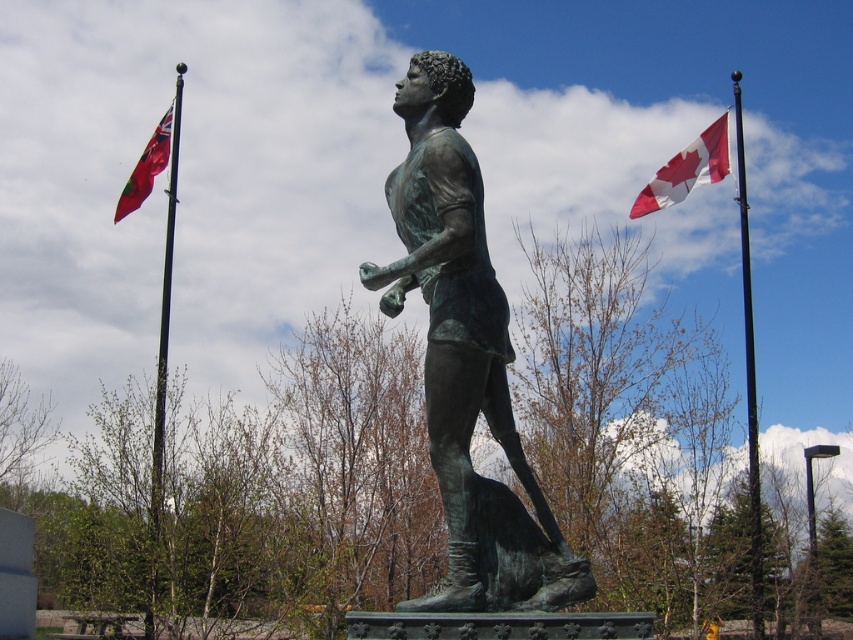
You are a visitor at a park with the bronze statue of a person standing upright facing left. You notice the polished metal flagpole at left and the red fabric flag at left. Which object is taller?

The polished metal flagpole at left is much taller than the red fabric flag at left.

You are a photographer standing in front of the bronze statue at center and the black metal pole at upper right. You want to take a photo that includes both objects in the frame. Which object should you position closer to the camera to ensure both are fully visible?

To include both the bronze statue at center and the black metal pole at upper right in the frame, position the bronze statue at center closer to the camera since it is in front of the black metal pole at upper right.

You are a visitor at a park and see the polished metal flagpole at left and the red fabric flag at left. Which object is higher from the ground?

The red fabric flag at left is higher from the ground than the polished metal flagpole at left because the polished metal flagpole at left is below red fabric flag at left.